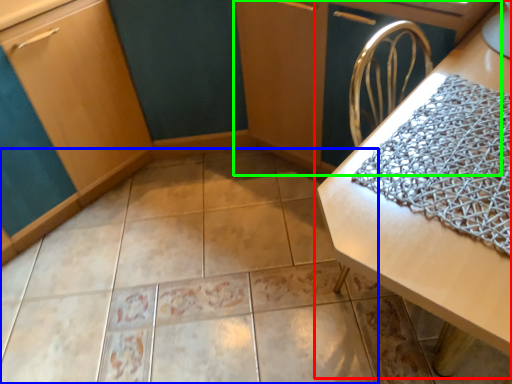
Question: Which object is the closest to the table (highlighted by a red box)? Choose among these: ceramic tile (highlighted by a blue box) or dresser (highlighted by a green box).

Choices:
 (A) ceramic tile
 (B) dresser

Answer: (B)